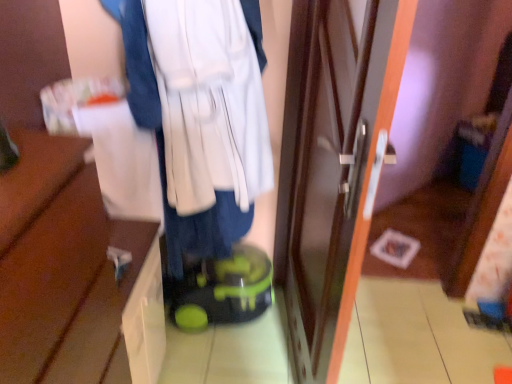
Find the location of a particular element. This screenshot has height=384, width=512. white fabric cardigan at center is located at coordinates (209, 102).

What do you see at coordinates (209, 102) in the screenshot? Image resolution: width=512 pixels, height=384 pixels. I see `white fabric cardigan at center` at bounding box center [209, 102].

The width and height of the screenshot is (512, 384). In order to click on white fabric cardigan at center in this screenshot , I will do `click(209, 102)`.